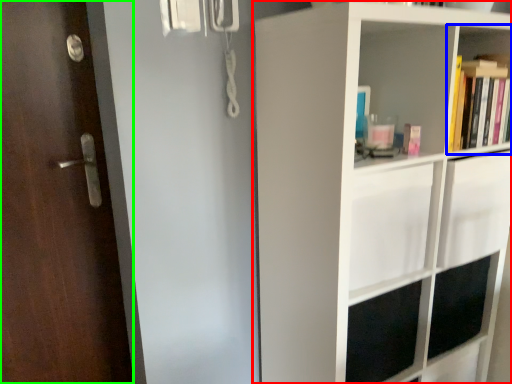
Question: Which object is positioned farthest from shelf (highlighted by a red box)? Select from shelf (highlighted by a blue box) and door (highlighted by a green box).

Choices:
 (A) shelf
 (B) door

Answer: (B)